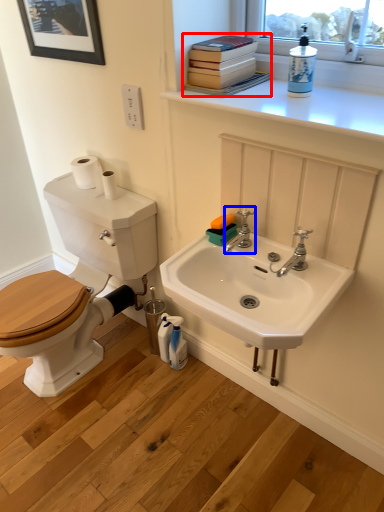
Question: Which of the following is the farthest to the observer, book (highlighted by a red box) or tap (highlighted by a blue box)?

Choices:
 (A) book
 (B) tap

Answer: (B)